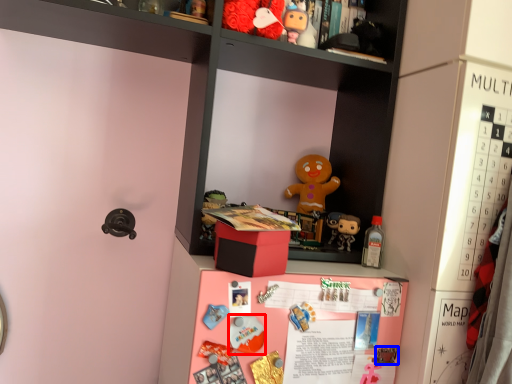
Question: Which of the following is the closest to the observer, toy (highlighted by a red box) or toy (highlighted by a blue box)?

Choices:
 (A) toy
 (B) toy

Answer: (A)